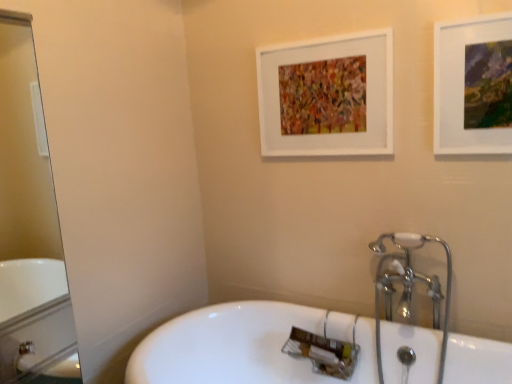
What do you see at coordinates (304, 360) in the screenshot? I see `white glossy bathtub at center` at bounding box center [304, 360].

What is the approximate height of white glossy bathtub at center?

The height of white glossy bathtub at center is 20.04 inches.

This screenshot has width=512, height=384. Describe the element at coordinates (418, 247) in the screenshot. I see `chrome metallic faucet at right` at that location.

Where is `white matte picture frame at upper center, the second picture frame in the right-to-left sequence`? The image size is (512, 384). white matte picture frame at upper center, the second picture frame in the right-to-left sequence is located at coordinates (327, 96).

Describe the element at coordinates (327, 96) in the screenshot. I see `white matte picture frame at upper center, placed as the 1th picture frame when sorted from left to right` at that location.

Where is `clear glass mirror at left`? clear glass mirror at left is located at coordinates (29, 227).

Does white glossy bathtub at center lie behind white matte picture frame at upper center, placed as the 1th picture frame when sorted from left to right?

That is False.

How far apart are white glossy bathtub at center and white matte picture frame at upper center, placed as the 1th picture frame when sorted from left to right?

25.53 inches.

In the scene shown: Is white matte picture frame at upper center, which is the 2th picture frame from front to back, inside white glossy bathtub at center?

That's incorrect, white matte picture frame at upper center, which is the 2th picture frame from front to back, is not inside white glossy bathtub at center.

Does white glossy bathtub at center appear on the right side of white matte picture frame at upper center, which is the 2th picture frame from front to back?

No, white glossy bathtub at center is not to the right of white matte picture frame at upper center, which is the 2th picture frame from front to back.

Image resolution: width=512 pixels, height=384 pixels. I want to click on tap located on the right of white glossy bathtub at center, so click(418, 247).

Which object is thinner, white glossy bathtub at center or chrome metallic faucet at right?

chrome metallic faucet at right is thinner.

Consider the image. Can you confirm if white glossy bathtub at center is bigger than chrome metallic faucet at right?

Yes.

Could you measure the distance between clear glass mirror at left and matte white picture frame at upper right, the 1th picture frame from the right?

clear glass mirror at left is 6.39 feet away from matte white picture frame at upper right, the 1th picture frame from the right.

Which is farther, (10, 166) or (504, 105)?

Point (10, 166)

In the image, there is a matte white picture frame at upper right, marked as the 2th picture frame in a left-to-right arrangement. In order to click on mirror below it (from a real-world perspective) in this screenshot , I will do `click(29, 227)`.

Would you consider white matte picture frame at upper center, marked as the 1th picture frame in a back-to-front arrangement, to be distant from clear glass mirror at left?

Absolutely, white matte picture frame at upper center, marked as the 1th picture frame in a back-to-front arrangement, is distant from clear glass mirror at left.

Does white matte picture frame at upper center, the second picture frame in the right-to-left sequence, have a lesser height compared to clear glass mirror at left?

Correct, white matte picture frame at upper center, the second picture frame in the right-to-left sequence, is not as tall as clear glass mirror at left.

From a real-world perspective, does white matte picture frame at upper center, marked as the 1th picture frame in a back-to-front arrangement, stand above clear glass mirror at left?

Yes, from a real-world perspective, white matte picture frame at upper center, marked as the 1th picture frame in a back-to-front arrangement, is above clear glass mirror at left.

Looking at their sizes, would you say white matte picture frame at upper center, marked as the 1th picture frame in a back-to-front arrangement, is wider or thinner than clear glass mirror at left?

Clearly, white matte picture frame at upper center, marked as the 1th picture frame in a back-to-front arrangement, has less width compared to clear glass mirror at left.

Looking at their sizes, would you say clear glass mirror at left is wider or thinner than white glossy bathtub at center?

Considering their sizes, clear glass mirror at left looks slimmer than white glossy bathtub at center.

Could white glossy bathtub at center be considered to be inside clear glass mirror at left?

Definitely not — white glossy bathtub at center is not inside clear glass mirror at left.

How many degrees apart are the facing directions of clear glass mirror at left and white glossy bathtub at center?

88 degrees separate the facing orientations of clear glass mirror at left and white glossy bathtub at center.

From a real-world perspective, which object rests below the other?

From a 3D spatial view, white glossy bathtub at center is below.

Would you say clear glass mirror at left is outside chrome metallic faucet at right?

That's correct, clear glass mirror at left is outside of chrome metallic faucet at right.

I want to click on mirror in front of the chrome metallic faucet at right, so click(x=29, y=227).

Considering the sizes of objects clear glass mirror at left and chrome metallic faucet at right in the image provided, who is wider, clear glass mirror at left or chrome metallic faucet at right?

Wider between the two is clear glass mirror at left.

Which of these two, clear glass mirror at left or chrome metallic faucet at right, is bigger?

clear glass mirror at left is bigger.

From a real-world perspective, does white matte picture frame at upper center, placed as the 1th picture frame when sorted from left to right, sit lower than matte white picture frame at upper right, which appears as the second picture frame when viewed from the back?

No, from a real-world perspective, white matte picture frame at upper center, placed as the 1th picture frame when sorted from left to right, is not beneath matte white picture frame at upper right, which appears as the second picture frame when viewed from the back.

At what (x,y) coordinates should I click in order to perform the action: click on picture frame lying behind the matte white picture frame at upper right, the 1th picture frame from the right. Please return your answer as a coordinate pair (x, y). The width and height of the screenshot is (512, 384). Looking at the image, I should click on (327, 96).

From the image's perspective, between white matte picture frame at upper center, placed as the 1th picture frame when sorted from left to right, and matte white picture frame at upper right, the 1th picture frame from the right, who is located below?

From the image's view, matte white picture frame at upper right, the 1th picture frame from the right, is below.

Looking at this image, is white matte picture frame at upper center, marked as the 1th picture frame in a back-to-front arrangement, to the left of matte white picture frame at upper right, marked as the 2th picture frame in a left-to-right arrangement, from the viewer's perspective?

Indeed, white matte picture frame at upper center, marked as the 1th picture frame in a back-to-front arrangement, is positioned on the left side of matte white picture frame at upper right, marked as the 2th picture frame in a left-to-right arrangement.

In order to click on bathtub located below the white matte picture frame at upper center, marked as the 1th picture frame in a back-to-front arrangement (from the image's perspective) in this screenshot , I will do tap(304, 360).

Where is `tap lying on the right of white glossy bathtub at center`? The image size is (512, 384). tap lying on the right of white glossy bathtub at center is located at coordinates (418, 247).

Which object lies nearer to the anchor point clear glass mirror at left, white glossy bathtub at center or white matte picture frame at upper center, placed as the 1th picture frame when sorted from left to right?

Among the two, white glossy bathtub at center is located nearer to clear glass mirror at left.

Looking at the image, which one is located closer to clear glass mirror at left, white matte picture frame at upper center, marked as the 1th picture frame in a back-to-front arrangement, or chrome metallic faucet at right?

The object closer to clear glass mirror at left is white matte picture frame at upper center, marked as the 1th picture frame in a back-to-front arrangement.

Considering their positions, is white matte picture frame at upper center, the second picture frame in the right-to-left sequence, positioned closer to white glossy bathtub at center than matte white picture frame at upper right, arranged as the 1th picture frame when viewed from the front?

white matte picture frame at upper center, the second picture frame in the right-to-left sequence, is positioned closer to the anchor white glossy bathtub at center.

Based on the photo, when comparing their distances from matte white picture frame at upper right, marked as the 2th picture frame in a left-to-right arrangement, does white matte picture frame at upper center, the second picture frame in the right-to-left sequence, or clear glass mirror at left seem closer?

white matte picture frame at upper center, the second picture frame in the right-to-left sequence, is positioned closer to the anchor matte white picture frame at upper right, marked as the 2th picture frame in a left-to-right arrangement.

When comparing their distances from white matte picture frame at upper center, which is the 2th picture frame from front to back, does white glossy bathtub at center or matte white picture frame at upper right, the 1th picture frame from the right, seem further?

The object further to white matte picture frame at upper center, which is the 2th picture frame from front to back, is white glossy bathtub at center.

Based on their spatial positions, is white glossy bathtub at center or matte white picture frame at upper right, marked as the 2th picture frame in a left-to-right arrangement, closer to clear glass mirror at left?

white glossy bathtub at center is positioned closer to the anchor clear glass mirror at left.

Based on their spatial positions, is white matte picture frame at upper center, the second picture frame in the right-to-left sequence, or white glossy bathtub at center closer to matte white picture frame at upper right, marked as the 2th picture frame in a left-to-right arrangement?

The object closer to matte white picture frame at upper right, marked as the 2th picture frame in a left-to-right arrangement, is white matte picture frame at upper center, the second picture frame in the right-to-left sequence.

Estimate the real-world distances between objects in this image. Which object is closer to matte white picture frame at upper right, which appears as the second picture frame when viewed from the back, clear glass mirror at left or white glossy bathtub at center?

white glossy bathtub at center is positioned closer to the anchor matte white picture frame at upper right, which appears as the second picture frame when viewed from the back.

Locate an element on the screen. The image size is (512, 384). picture frame situated between clear glass mirror at left and matte white picture frame at upper right, the 1th picture frame from the right, from left to right is located at coordinates (327, 96).

I want to click on tap between white matte picture frame at upper center, which is the 2th picture frame from front to back, and white glossy bathtub at center from top to bottom, so click(x=418, y=247).

The height and width of the screenshot is (384, 512). In order to click on tap located between clear glass mirror at left and matte white picture frame at upper right, marked as the 2th picture frame in a left-to-right arrangement, in the left-right direction in this screenshot , I will do `click(418, 247)`.

The height and width of the screenshot is (384, 512). Find the location of `picture frame between clear glass mirror at left and chrome metallic faucet at right`. picture frame between clear glass mirror at left and chrome metallic faucet at right is located at coordinates (327, 96).